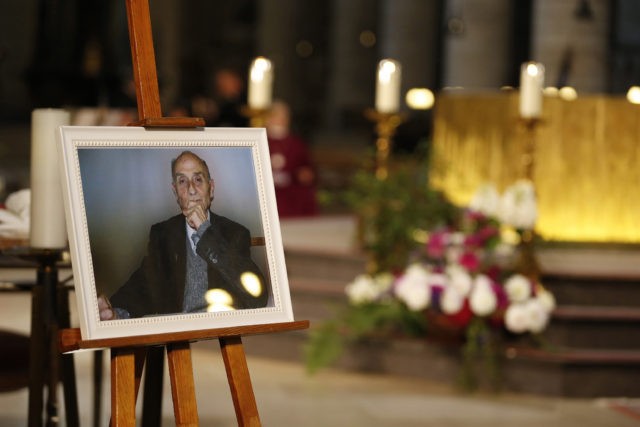
Find the location of a particular element. Image resolution: width=640 pixels, height=427 pixels. flower bouquet is located at coordinates pos(362,296), pos(419,290), pos(461,293), pos(486,296), pos(520,301), pos(464,261).